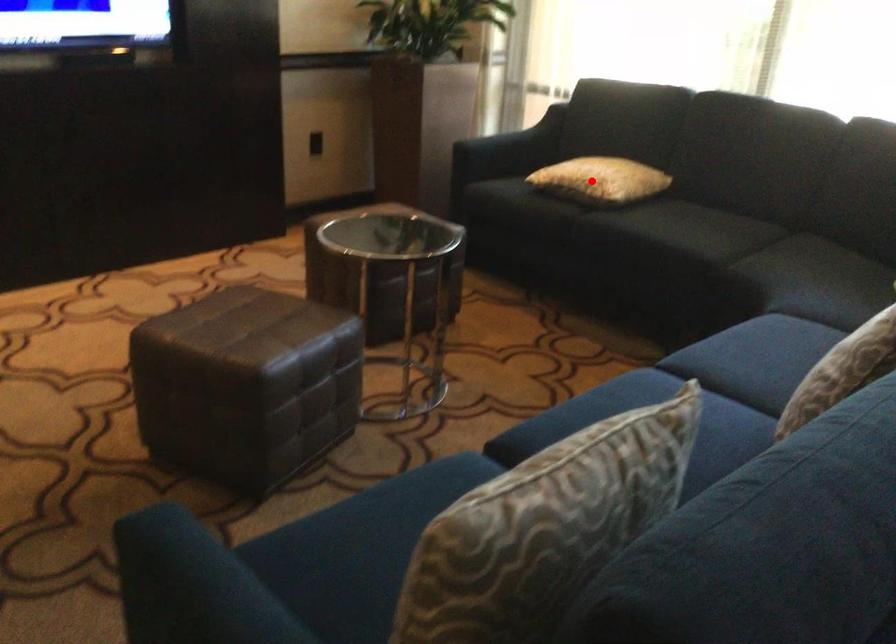
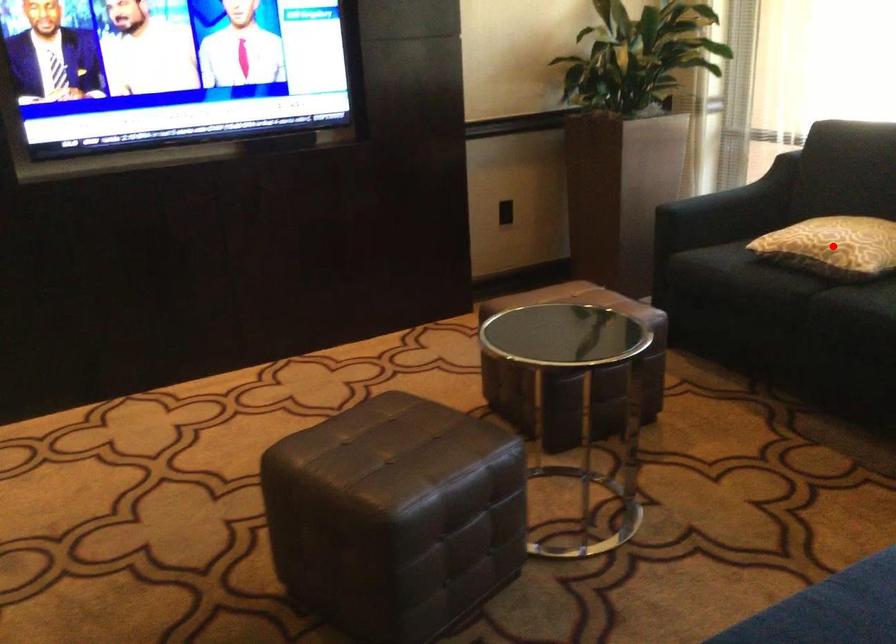
I am providing you with two images of the same scene from different viewpoints. A red point is marked on the first image and another point is marked on the second image. Does the point marked in image1 correspond to the same location as the one in image2?

Yes